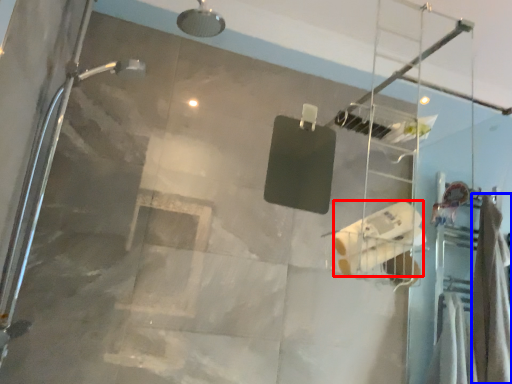
Question: Among these objects, which one is farthest to the camera, toilet paper (highlighted by a red box) or shower curtain (highlighted by a blue box)?

Choices:
 (A) toilet paper
 (B) shower curtain

Answer: (B)